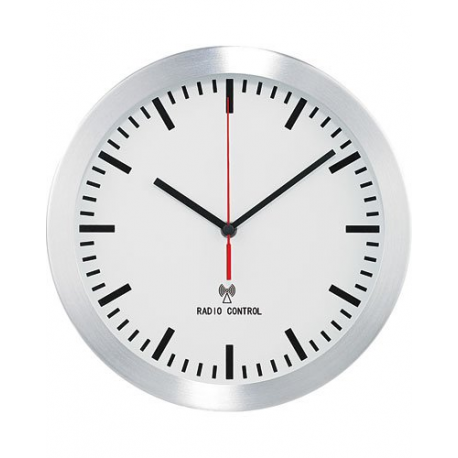
This screenshot has width=458, height=458. I want to click on white clock face, so click(159, 236).